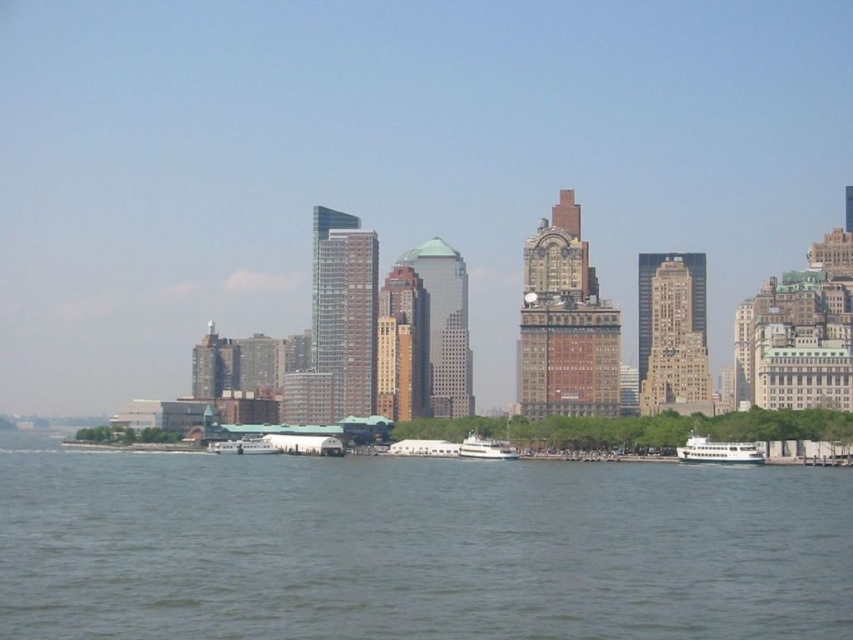
Question: Does green water at lower center have a smaller size compared to white glossy ferry at center?

Choices:
 (A) no
 (B) yes

Answer: (A)

Question: Does green water at lower center lie in front of white glossy ferry at lower right?

Choices:
 (A) no
 (B) yes

Answer: (B)

Question: Which object is closer to the camera taking this photo?

Choices:
 (A) white glossy ferry at center
 (B) green water at lower center
 (C) white glossy ferry at lower right

Answer: (B)

Question: Which object is the farthest from the white glossy ferry at center?

Choices:
 (A) white glossy ferry at lower right
 (B) green water at lower center

Answer: (A)

Question: Is green water at lower center thinner than white glossy ferry at center?

Choices:
 (A) yes
 (B) no

Answer: (B)

Question: Which object is closer to the camera taking this photo?

Choices:
 (A) green water at lower center
 (B) white glossy ferry at center
 (C) white glossy ferry at lower right

Answer: (A)